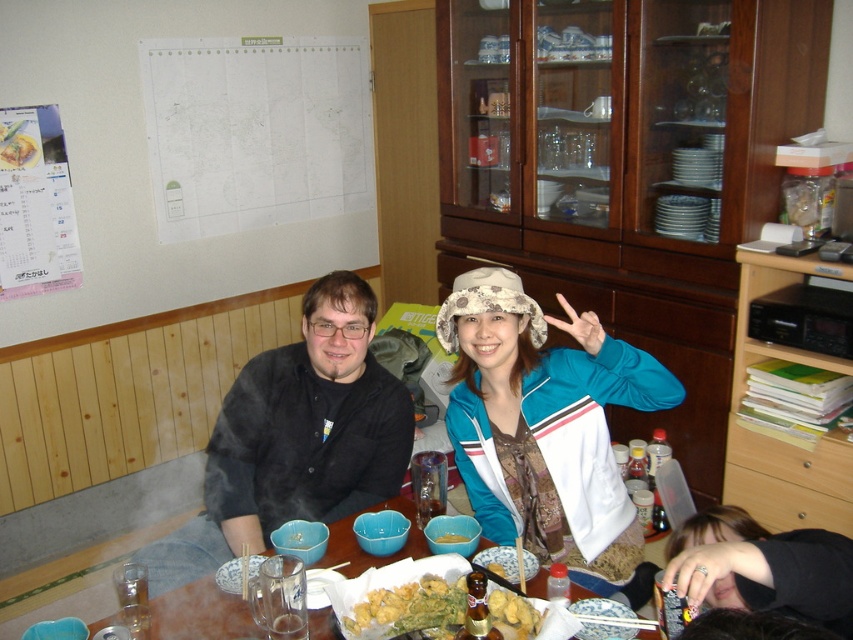
You are a guest at the gathering and see the blue fabric jacket at center and the golden crispy tempura at center on the table. If you want to reach the tempura first, which object should you move first?

The blue fabric jacket at center is to the right of the golden crispy tempura at center. To reach the tempura first, you should move the blue fabric jacket at center out of the way since it is blocking the path to the tempura.